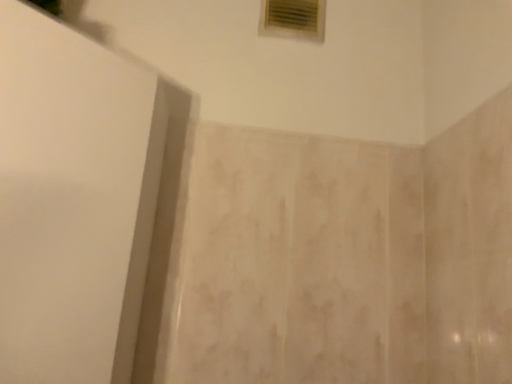
What are the coordinates of `white plastic vent at upper center` in the screenshot? It's located at (293, 19).

Describe the element at coordinates (293, 19) in the screenshot. The image size is (512, 384). I see `white plastic vent at upper center` at that location.

Based on the photo, measure the distance between white matte screen door at left and camera.

white matte screen door at left and camera are 20.22 inches apart from each other.

What do you see at coordinates (73, 201) in the screenshot?
I see `white matte screen door at left` at bounding box center [73, 201].

The image size is (512, 384). Identify the location of white matte screen door at left. (73, 201).

At what (x,y) coordinates should I click in order to perform the action: click on white plastic vent at upper center. Please return your answer as a coordinate pair (x, y). This screenshot has width=512, height=384. Looking at the image, I should click on (293, 19).

Which object is positioned more to the right, white matte screen door at left or white plastic vent at upper center?

From the viewer's perspective, white plastic vent at upper center appears more on the right side.

Considering the positions of objects white matte screen door at left and white plastic vent at upper center in the image provided, who is behind, white matte screen door at left or white plastic vent at upper center?

white plastic vent at upper center is further from the camera.

Is point (18, 337) positioned in front of point (307, 24)?

Yes.

From the image's perspective, is white matte screen door at left on top of white plastic vent at upper center?

Actually, white matte screen door at left appears below white plastic vent at upper center in the image.

From a real-world perspective, is white matte screen door at left above or below white plastic vent at upper center?

In terms of real-world spatial position, white matte screen door at left is below white plastic vent at upper center.

Which object is thinner, white matte screen door at left or white plastic vent at upper center?

white plastic vent at upper center.

Is white matte screen door at left shorter than white plastic vent at upper center?

No.

Which of these two, white matte screen door at left or white plastic vent at upper center, is smaller?

white plastic vent at upper center.

Do you think white matte screen door at left is within white plastic vent at upper center, or outside of it?

white matte screen door at left is not enclosed by white plastic vent at upper center.

Is white matte screen door at left in contact with white plastic vent at upper center?

white matte screen door at left and white plastic vent at upper center are not in contact.

Is white matte screen door at left aimed at white plastic vent at upper center?

No, white matte screen door at left is not turned towards white plastic vent at upper center.

Measure the distance between white matte screen door at left and white plastic vent at upper center.

The distance of white matte screen door at left from white plastic vent at upper center is 56.95 centimeters.

The height and width of the screenshot is (384, 512). Find the location of `screen door on the left of white plastic vent at upper center`. screen door on the left of white plastic vent at upper center is located at coordinates (73, 201).

Based on their positions, is white plastic vent at upper center located to the left or right of white matte screen door at left?

white plastic vent at upper center is to the right of white matte screen door at left.

Is white plastic vent at upper center behind white matte screen door at left?

Yes.

Which is farther, (310, 39) or (135, 159)?

Positioned behind is point (310, 39).

From the image's perspective, is white plastic vent at upper center above white matte screen door at left?

Correct, white plastic vent at upper center appears higher than white matte screen door at left in the image.

From a real-world perspective, is white plastic vent at upper center physically located above or below white matte screen door at left?

white plastic vent at upper center is above white matte screen door at left.

Considering the relative sizes of white plastic vent at upper center and white matte screen door at left in the image provided, is white plastic vent at upper center wider than white matte screen door at left?

Incorrect, the width of white plastic vent at upper center does not surpass that of white matte screen door at left.

Considering the sizes of objects white plastic vent at upper center and white matte screen door at left in the image provided, who is taller, white plastic vent at upper center or white matte screen door at left?

white matte screen door at left is taller.

In terms of size, does white plastic vent at upper center appear bigger or smaller than white matte screen door at left?

Clearly, white plastic vent at upper center is smaller in size than white matte screen door at left.

Is white plastic vent at upper center positioned beyond the bounds of white matte screen door at left?

Yes, white plastic vent at upper center is not within white matte screen door at left.

Is the surface of white plastic vent at upper center in direct contact with white matte screen door at left?

There is a gap between white plastic vent at upper center and white matte screen door at left.

Is white plastic vent at upper center turned away from white matte screen door at left?

white plastic vent at upper center does not have its back to white matte screen door at left.

At what (x,y) coordinates should I click in order to perform the action: click on window on the right of white matte screen door at left. Please return your answer as a coordinate pair (x, y). Looking at the image, I should click on (293, 19).

The image size is (512, 384). I want to click on screen door that appears in front of the white plastic vent at upper center, so click(x=73, y=201).

At what (x,y) coordinates should I click in order to perform the action: click on window on the right of white matte screen door at left. Please return your answer as a coordinate pair (x, y). Looking at the image, I should click on click(x=293, y=19).